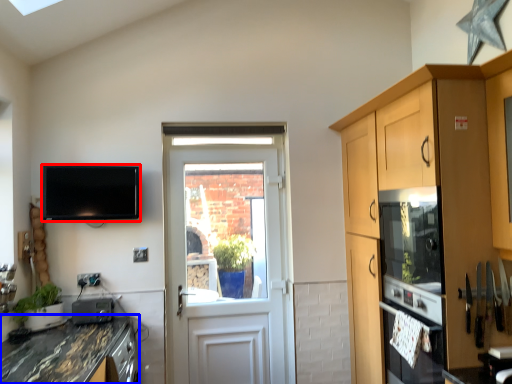
Question: Which point is further to the camera, television (highlighted by a red box) or countertop (highlighted by a blue box)?

Choices:
 (A) television
 (B) countertop

Answer: (A)